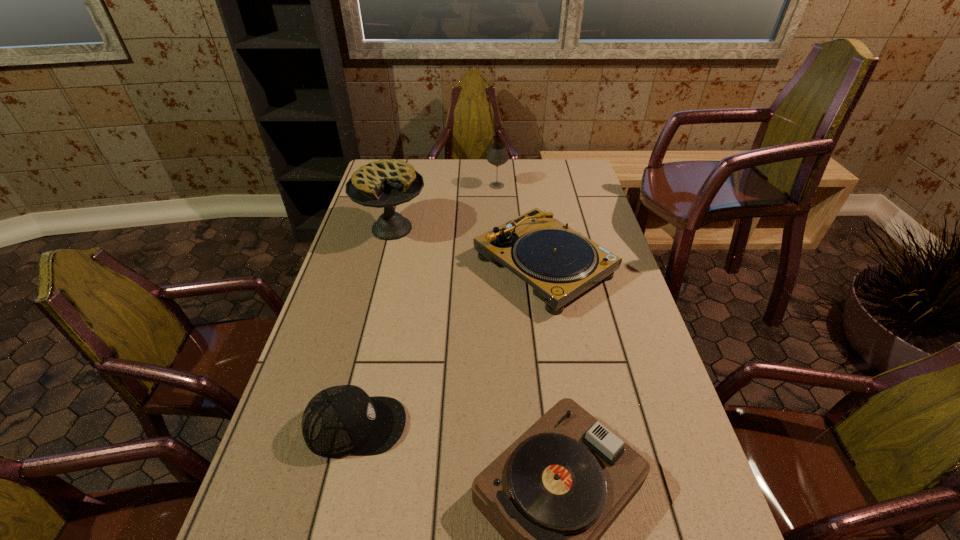
Locate an element on the screen. Image resolution: width=960 pixels, height=540 pixels. free space that is in between the pie and the farther record player is located at coordinates (468, 247).

You are a GUI agent. You are given a task and a screenshot of the screen. Output one action in this format:
    pyautogui.click(x=<x>, y=<y>)
    Task: Click on the free space between the cap and the farthest object
    Image resolution: width=960 pixels, height=540 pixels.
    Given the screenshot: What is the action you would take?
    pyautogui.click(x=426, y=306)

Identify the location of free area in between the cap and the farther record player. (449, 346).

Point out which object is positioned as the nearest to the nearer record player. Please provide its 2D coordinates. Your answer should be formatted as a tuple, i.e. [(x, y)], where the tuple contains the x and y coordinates of a point satisfying the conditions above.

[(338, 421)]

Identify which object is the nearest to the cap. Please provide its 2D coordinates. Your answer should be formatted as a tuple, i.e. [(x, y)], where the tuple contains the x and y coordinates of a point satisfying the conditions above.

[(552, 494)]

Where is `vacant space that satisfies the following two spatial constraints: 1. on the cut side of the pie; 2. on the right side of the farther record player`? vacant space that satisfies the following two spatial constraints: 1. on the cut side of the pie; 2. on the right side of the farther record player is located at coordinates point(383,266).